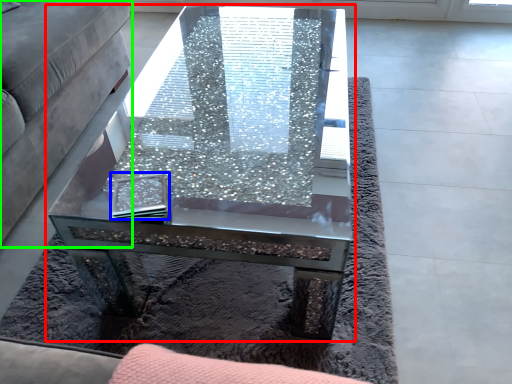
Question: Which is nearer to the coffee table (highlighted by a red box)? pad (highlighted by a blue box) or studio couch (highlighted by a green box).

Choices:
 (A) pad
 (B) studio couch

Answer: (A)